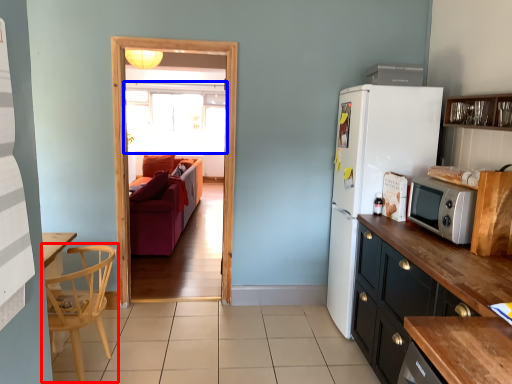
Question: Which point is further to the camera, chair (highlighted by a red box) or window (highlighted by a blue box)?

Choices:
 (A) chair
 (B) window

Answer: (B)